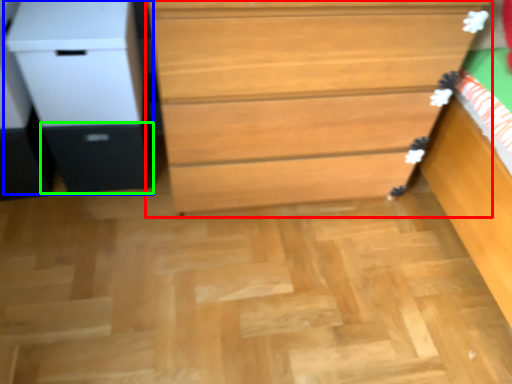
Question: Which object is the closest to the chest of drawers (highlighted by a red box)? Choose among these: file cabinet (highlighted by a blue box) or drawer (highlighted by a green box).

Choices:
 (A) file cabinet
 (B) drawer

Answer: (A)